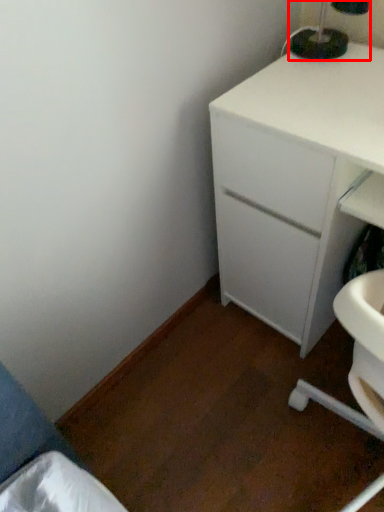
Question: From the image's perspective, where is bedside lamp (annotated by the red box) located in relation to chest of drawers in the image?

Choices:
 (A) below
 (B) above

Answer: (B)